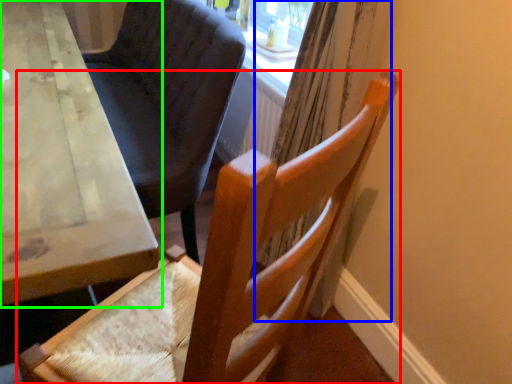
Question: Which object is the closest to the chair (highlighted by a red box)? Choose among these: curtain (highlighted by a blue box) or table (highlighted by a green box).

Choices:
 (A) curtain
 (B) table

Answer: (B)